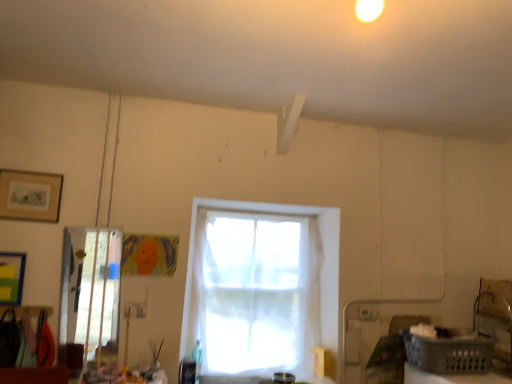
Question: In terms of width, does matte black picture frame at upper left look wider or thinner when compared to clear glass door at left?

Choices:
 (A) wide
 (B) thin

Answer: (B)

Question: Does point (41, 177) appear closer or farther from the camera than point (75, 253)?

Choices:
 (A) farther
 (B) closer

Answer: (A)

Question: Which object is the closest to the white sheer curtain at center?

Choices:
 (A) clear glass door at left
 (B) matte black picture frame at upper left
 (C) gray plastic basket at lower right

Answer: (C)

Question: Which object is the farthest from the clear glass door at left?

Choices:
 (A) white sheer curtain at center
 (B) matte black picture frame at upper left
 (C) gray plastic basket at lower right

Answer: (C)